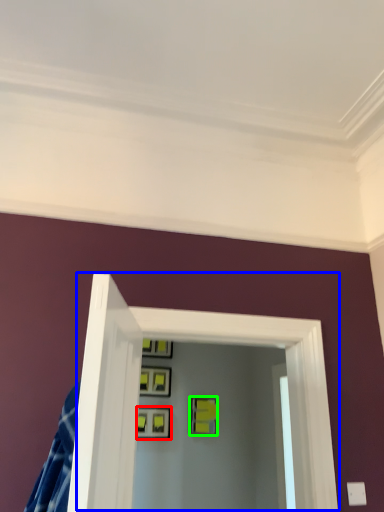
Question: Which object is the closest to the picture frame (highlighted by a red box)? Choose among these: glass door (highlighted by a blue box) or picture frame (highlighted by a green box).

Choices:
 (A) glass door
 (B) picture frame

Answer: (B)